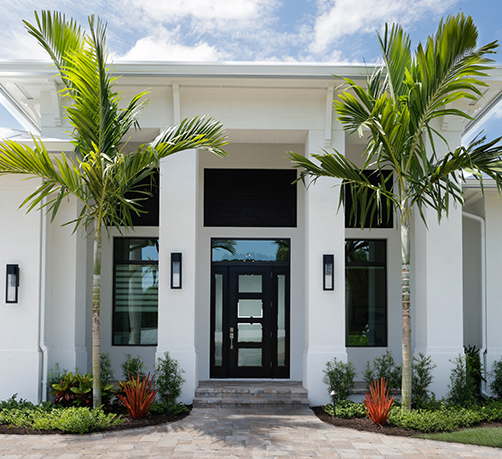
The height and width of the screenshot is (459, 502). I want to click on lights, so click(x=10, y=287), click(x=176, y=269), click(x=326, y=266).